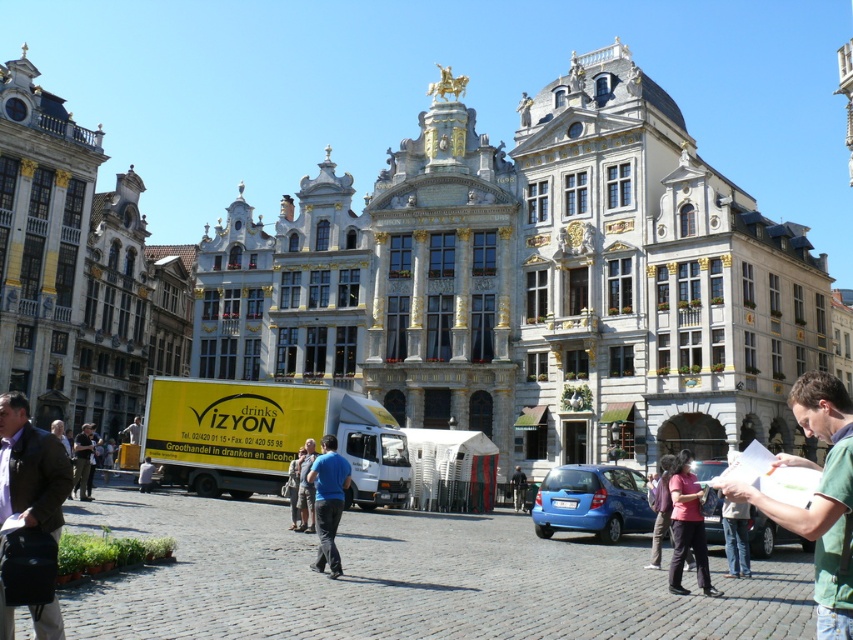
Between camouflage pants at center and dark blue jeans at lower left, which one is positioned higher?

dark blue jeans at lower left is above.

Based on the photo, does camouflage pants at center appear under dark blue jeans at lower left?

Yes.

Image resolution: width=853 pixels, height=640 pixels. Find the location of `camouflage pants at center`. camouflage pants at center is located at coordinates (306, 490).

The width and height of the screenshot is (853, 640). What do you see at coordinates (820, 499) in the screenshot? I see `green cotton shirt at lower right` at bounding box center [820, 499].

Between point (807, 509) and point (59, 637), which one is positioned behind?

Positioned behind is point (59, 637).

Locate an element on the screen. The height and width of the screenshot is (640, 853). green cotton shirt at lower right is located at coordinates (820, 499).

The image size is (853, 640). What do you see at coordinates (820, 499) in the screenshot?
I see `green cotton shirt at lower right` at bounding box center [820, 499].

Which is more to the left, green cotton shirt at lower right or dark blue jeans at lower left?

Positioned to the left is dark blue jeans at lower left.

The width and height of the screenshot is (853, 640). What do you see at coordinates (820, 499) in the screenshot? I see `green cotton shirt at lower right` at bounding box center [820, 499].

In order to click on green cotton shirt at lower right in this screenshot , I will do `click(820, 499)`.